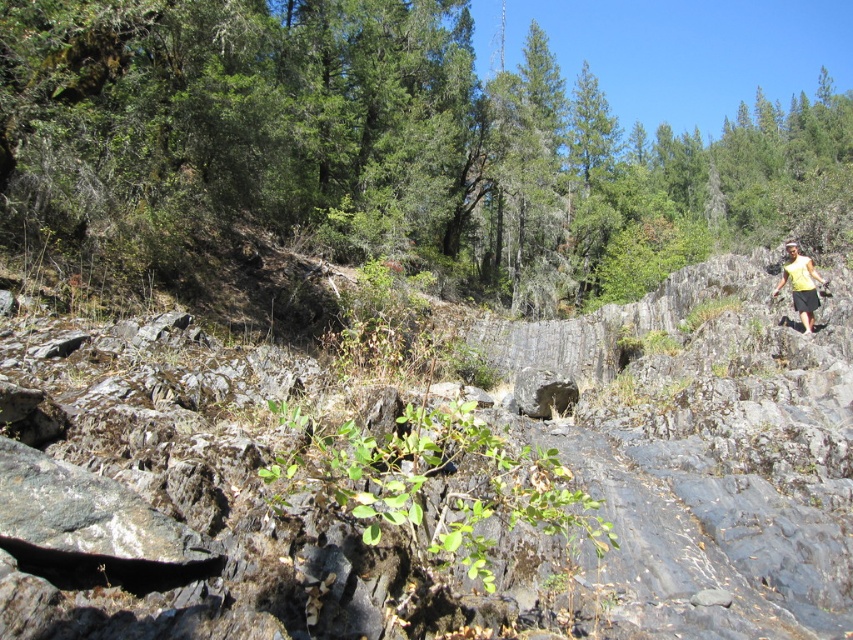
Question: Is green leafy tree at center further to the viewer compared to gray rough stone at center?

Choices:
 (A) no
 (B) yes

Answer: (A)

Question: Which object is the closest to the green leafy tree at center?

Choices:
 (A) gray rough stone at center
 (B) yellow fabric at right

Answer: (A)

Question: Which of the following is the closest to the observer?

Choices:
 (A) (537, 188)
 (B) (792, 291)
 (C) (537, 403)

Answer: (C)

Question: Which object appears farthest from the camera in this image?

Choices:
 (A) yellow fabric at right
 (B) green leafy tree at center

Answer: (A)

Question: Is green leafy tree at center to the left of yellow fabric at right from the viewer's perspective?

Choices:
 (A) no
 (B) yes

Answer: (A)

Question: Can you confirm if green leafy tree at center is positioned above yellow fabric at right?

Choices:
 (A) no
 (B) yes

Answer: (B)